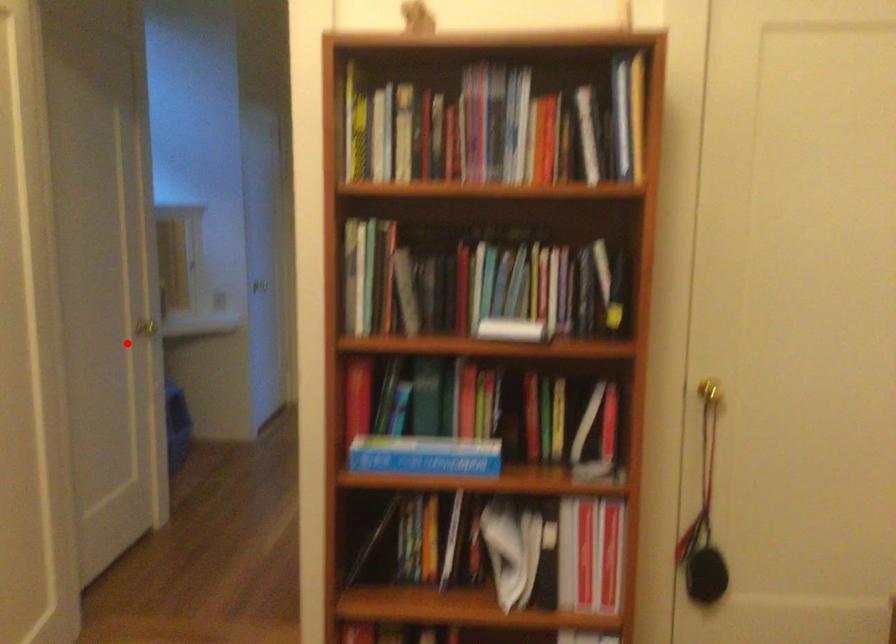
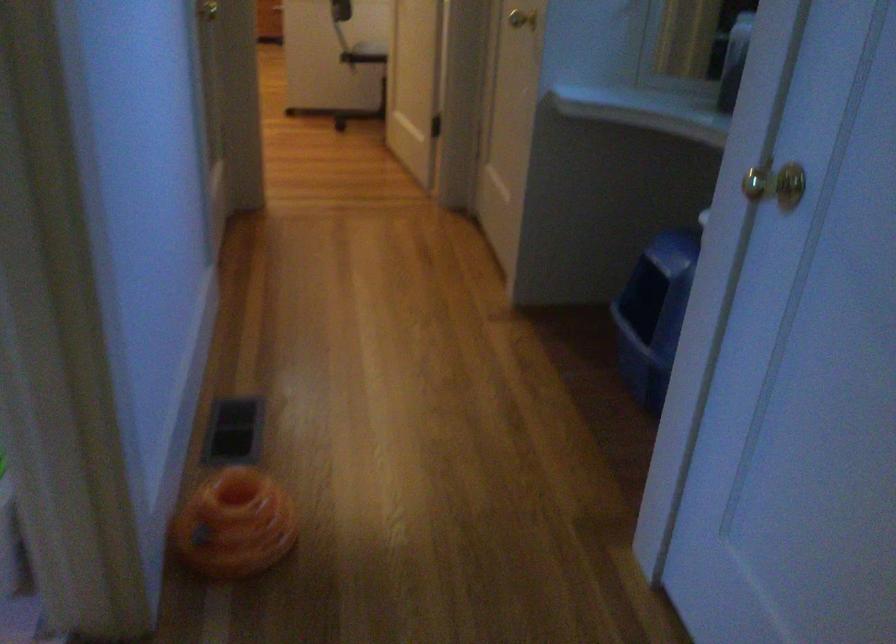
In the second image, find the point that corresponds to the highlighted location in the first image.

(521, 19)